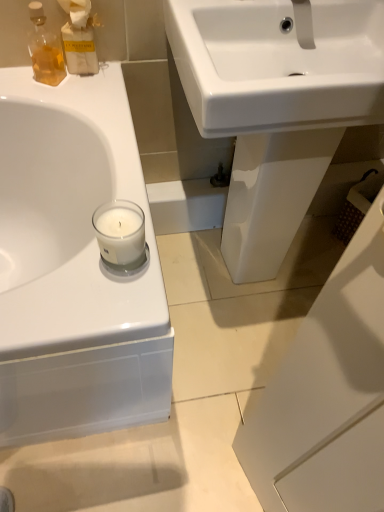
Locate an element on the screen. This screenshot has height=512, width=384. free space in front of white glossy sink at center is located at coordinates (226, 360).